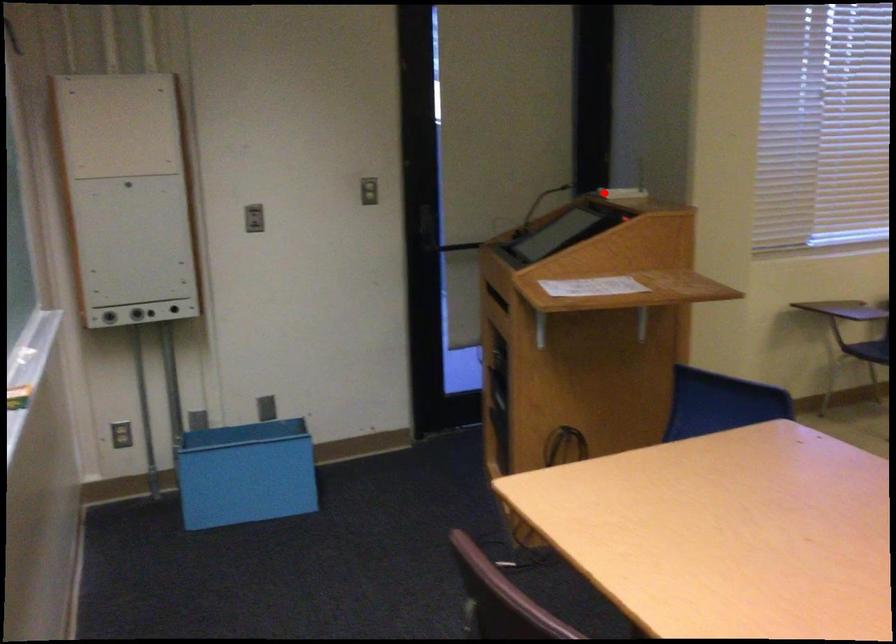
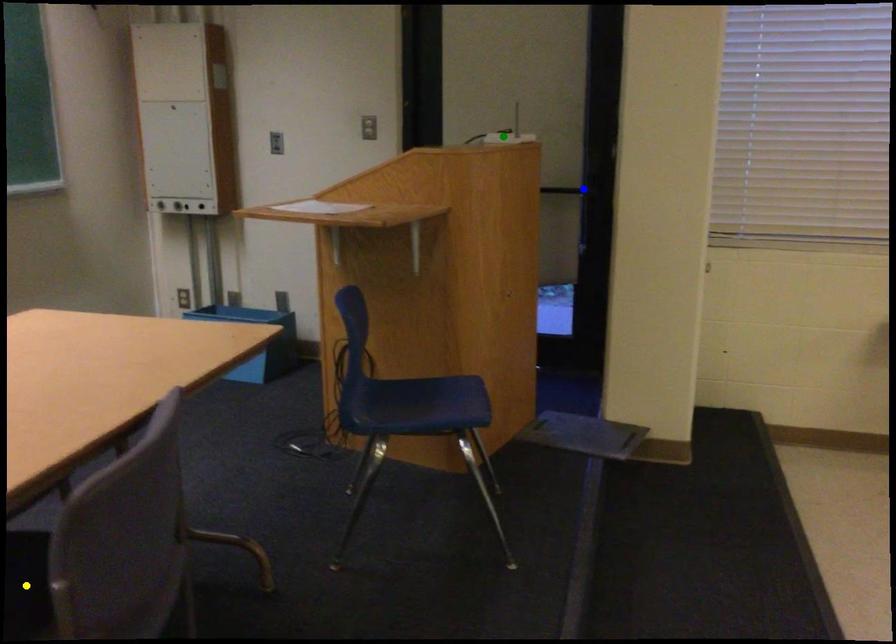
Question: I am providing you with two images of the same scene from different viewpoints. A red point is marked on the first image. You are given multiple points on the second image. Which mark in image 2 goes with the point in image 1?

Choices:
 (A) green point
 (B) blue point
 (C) yellow point

Answer: (A)